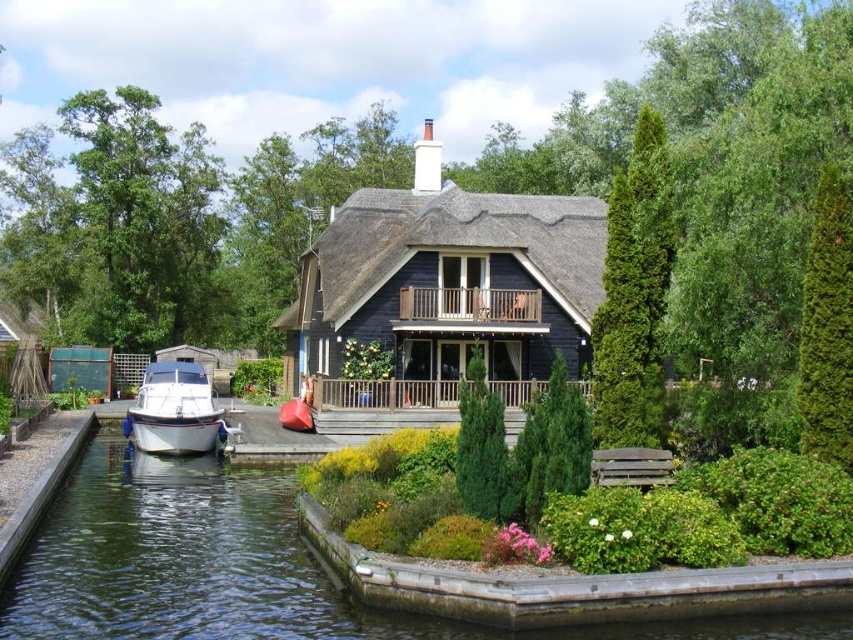
Is green coniferous tree at right further to camera compared to green textured evergreen tree at center?

Yes, it is.

Can you confirm if green coniferous tree at right is smaller than green textured evergreen tree at center?

Actually, green coniferous tree at right might be larger than green textured evergreen tree at center.

The image size is (853, 640). I want to click on green coniferous tree at right, so click(x=634, y=296).

Between dark blue wooden cottage at center and green textured hedge at right, which one is positioned lower?

green textured hedge at right is lower down.

Where is `dark blue wooden cottage at center`? dark blue wooden cottage at center is located at coordinates (445, 285).

Is point (252, 556) in front of point (483, 193)?

Yes, it is in front of point (483, 193).

Is clear water at lower left smaller than dark blue wooden cottage at center?

Yes.

Locate an element on the screen. clear water at lower left is located at coordinates (236, 566).